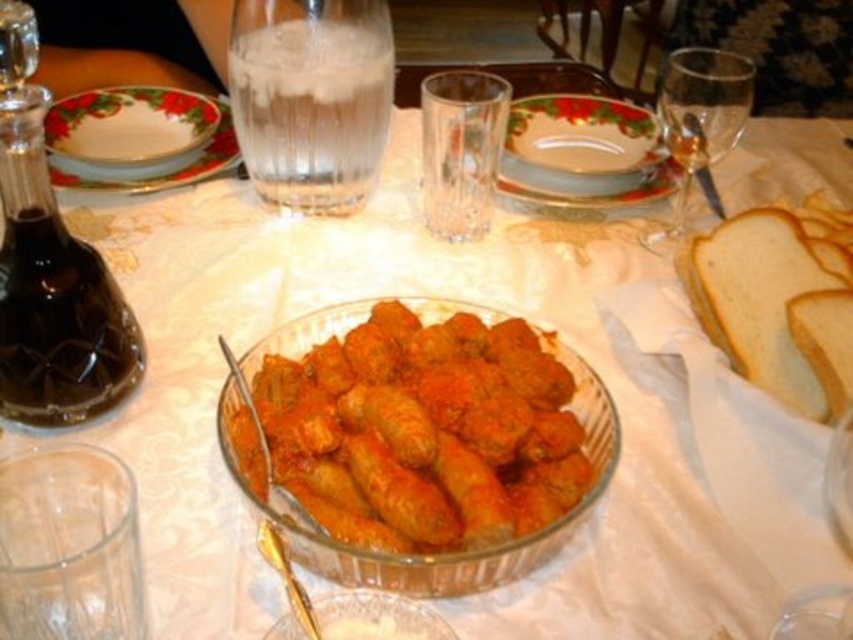
Question: Is golden brown breaded rolls at center bigger than gold metallic spoon at center?

Choices:
 (A) no
 (B) yes

Answer: (B)

Question: Does white soft bread at right have a lesser width compared to transparent glass wine glass at upper right?

Choices:
 (A) no
 (B) yes

Answer: (A)

Question: Among these objects, which one is farthest from the camera?

Choices:
 (A) golden brown breaded rolls at center
 (B) transparent glass wine glass at upper right

Answer: (B)

Question: Which object is the farthest from the golden brown breaded rolls at center?

Choices:
 (A) transparent glass wine glass at upper right
 (B) gold metallic spoon at center
 (C) decorative ceramic plate at upper left

Answer: (C)

Question: Which object appears farthest from the camera in this image?

Choices:
 (A) dark glass bottle at left
 (B) transparent glass wine glass at upper right
 (C) golden brown breaded rolls at center

Answer: (B)

Question: Is golden brown breaded rolls at center below gold metallic spoon at center?

Choices:
 (A) no
 (B) yes

Answer: (A)